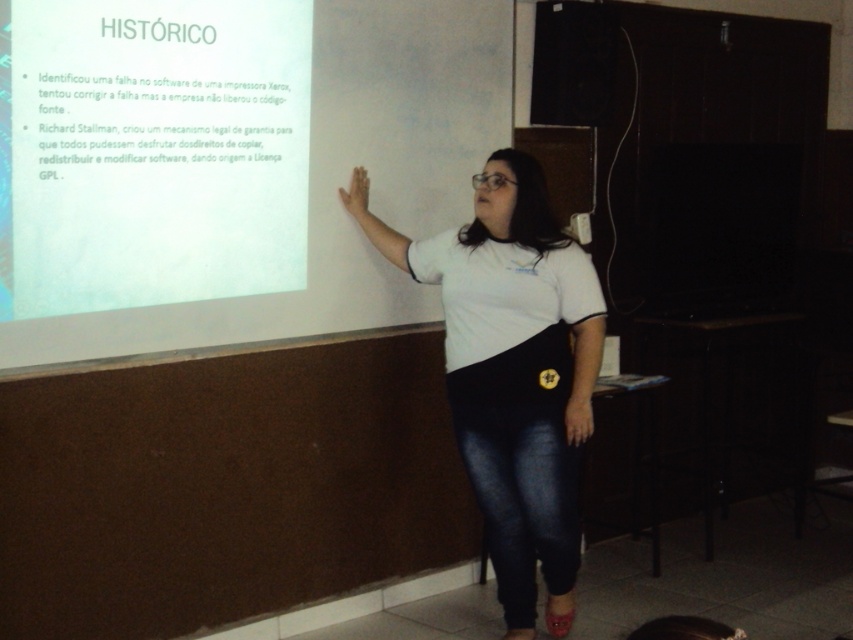
Is white matte projection screen at upper left to the right of white matte t-shirt at center from the viewer's perspective?

No, white matte projection screen at upper left is not to the right of white matte t-shirt at center.

Can you confirm if white matte projection screen at upper left is taller than white matte t-shirt at center?

No, white matte projection screen at upper left is not taller than white matte t-shirt at center.

Does point (236, 301) lie behind point (532, 179)?

Yes, point (236, 301) is behind point (532, 179).

I want to click on white matte projection screen at upper left, so click(x=344, y=180).